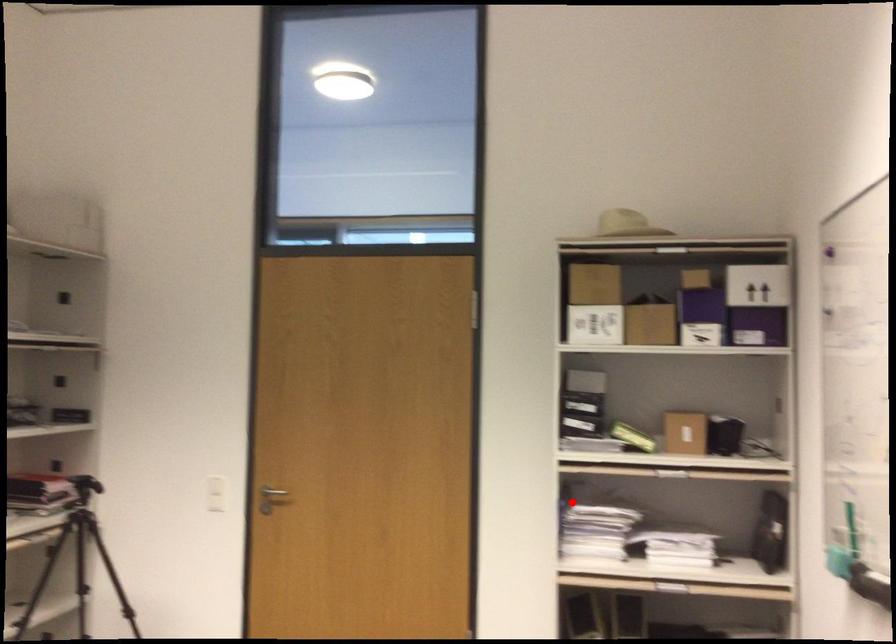
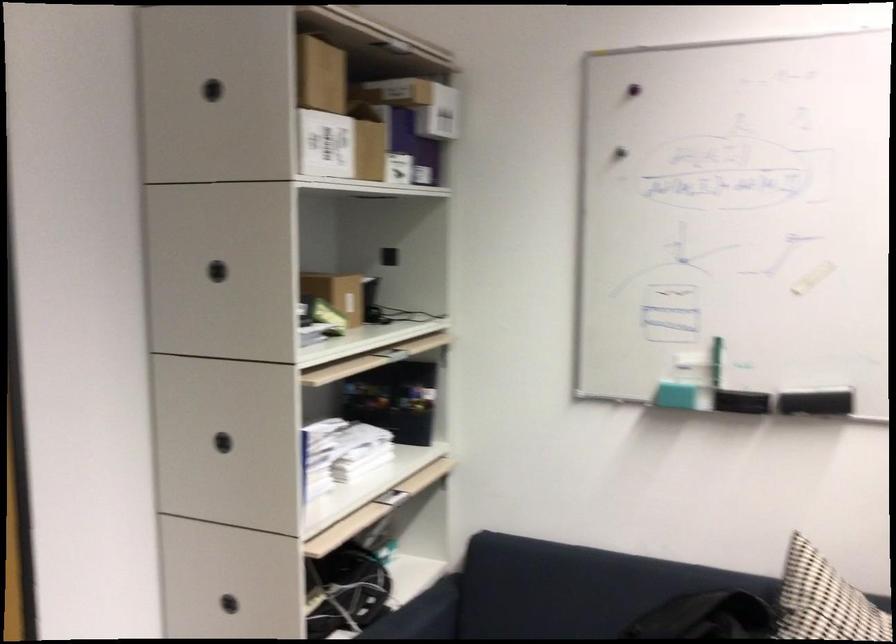
In the second image, find the point that corresponds to the highlighted location in the first image.

(222, 442)